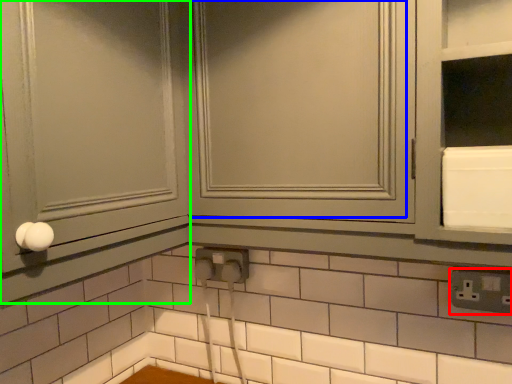
Question: Which is nearer to the electric outlet (highlighted by a red box)? window (highlighted by a blue box) or screen door (highlighted by a green box).

Choices:
 (A) window
 (B) screen door

Answer: (A)